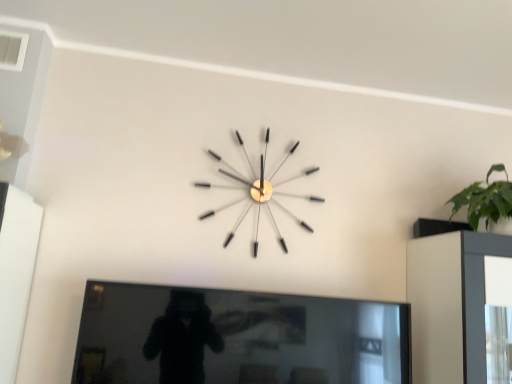
Question: Considering the positions of clear acrylic clock at center and black glossy tv at center in the image, is clear acrylic clock at center wider or thinner than black glossy tv at center?

Choices:
 (A) thin
 (B) wide

Answer: (A)

Question: Visually, is clear acrylic clock at center positioned to the left or to the right of black glossy tv at center?

Choices:
 (A) left
 (B) right

Answer: (B)

Question: In terms of height, does clear acrylic clock at center look taller or shorter compared to black glossy tv at center?

Choices:
 (A) short
 (B) tall

Answer: (B)

Question: In the image, is black glossy tv at center on the left side or the right side of clear acrylic clock at center?

Choices:
 (A) right
 (B) left

Answer: (B)

Question: Is black glossy tv at center in front of or behind clear acrylic clock at center in the image?

Choices:
 (A) front
 (B) behind

Answer: (A)

Question: In terms of height, does black glossy tv at center look taller or shorter compared to clear acrylic clock at center?

Choices:
 (A) tall
 (B) short

Answer: (B)

Question: From the image's perspective, is black glossy tv at center located above or below clear acrylic clock at center?

Choices:
 (A) above
 (B) below

Answer: (B)